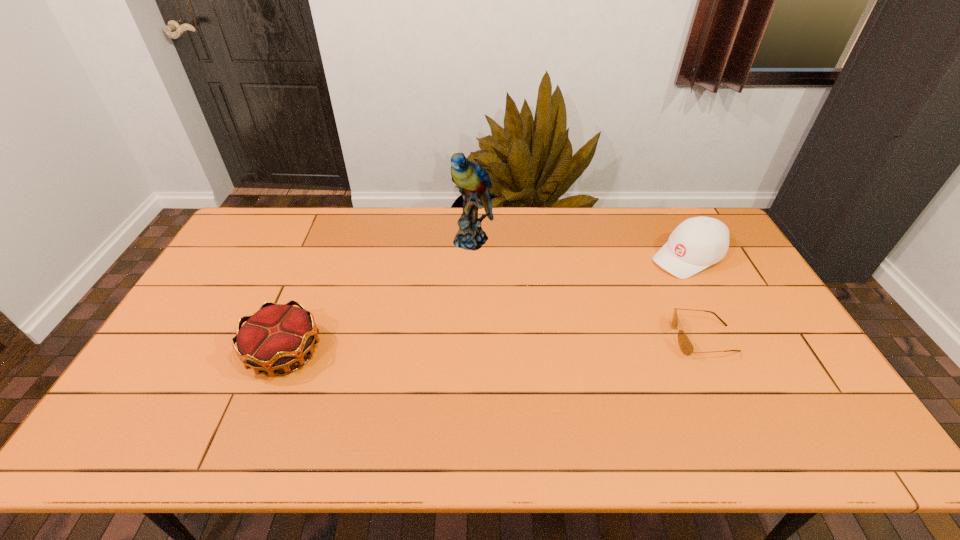
At what (x,y) coordinates should I click in order to perform the action: click on free space that satisfies the following two spatial constraints: 1. on the back side of the shortest object; 2. on the front-facing side of the third tallest object. Please return your answer as a coordinate pair (x, y). Image resolution: width=960 pixels, height=540 pixels. Looking at the image, I should click on (290, 339).